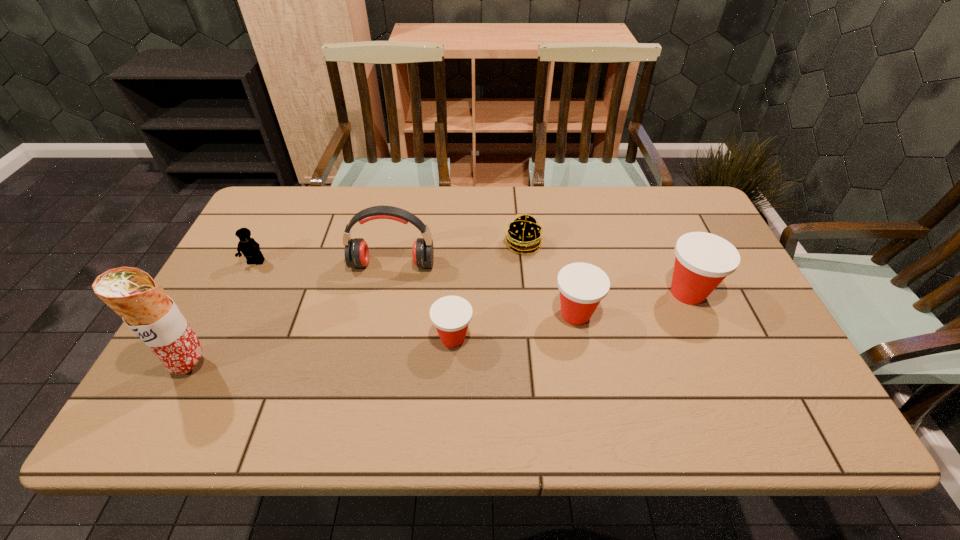
Find the location of a particular element. Image resolution: width=960 pixels, height=540 pixels. burrito that is at the left edge is located at coordinates (132, 293).

I want to click on object situated at the right edge, so click(703, 260).

Locate an element on the screen. The height and width of the screenshot is (540, 960). object at the near left corner is located at coordinates tap(132, 293).

Where is `vacant space at the far edge`? vacant space at the far edge is located at coordinates (374, 192).

In the image, there is a desktop. Where is `free space at the right edge`? free space at the right edge is located at coordinates (721, 282).

In the image, there is a desktop. Where is `vacant space at the far left corner`? vacant space at the far left corner is located at coordinates (258, 230).

In the image, there is a desktop. At what (x,y) coordinates should I click in order to perform the action: click on vacant region at the near left corner. Please return your answer as a coordinate pair (x, y). Looking at the image, I should click on (220, 393).

In the image, there is a desktop. Where is `vacant space at the far right corner`? The image size is (960, 540). vacant space at the far right corner is located at coordinates (653, 205).

Find the location of a particular element. free space between the tallest object and the patty is located at coordinates (357, 304).

The width and height of the screenshot is (960, 540). I want to click on vacant region between the shortest Dixie cup and the burrito, so click(x=323, y=351).